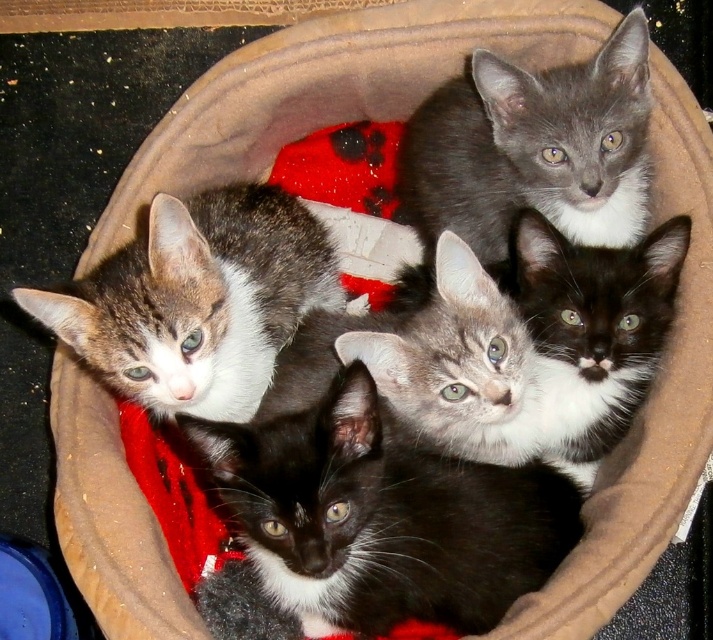
Question: Is speckled fur kitten at upper left wider than gray soft kitten at upper center?

Choices:
 (A) no
 (B) yes

Answer: (B)

Question: Which point is farther to the camera?

Choices:
 (A) black fur/kitten at center
 (B) speckled fur kitten at upper left
 (C) gray soft kitten at upper center

Answer: (C)

Question: Which of the following is the closest to the observer?

Choices:
 (A) (512, 541)
 (B) (145, 305)
 (C) (491, 456)
 (D) (632, 106)

Answer: (B)

Question: Which is farther from the speckled fur kitten at upper left?

Choices:
 (A) black fur/kitten at center
 (B) gray tabby kitten at center
 (C) gray soft kitten at upper center

Answer: (C)

Question: Does black fur/kitten at center have a larger size compared to gray soft kitten at upper center?

Choices:
 (A) yes
 (B) no

Answer: (A)

Question: Is black fur/kitten at center positioned in front of gray soft kitten at upper center?

Choices:
 (A) yes
 (B) no

Answer: (A)